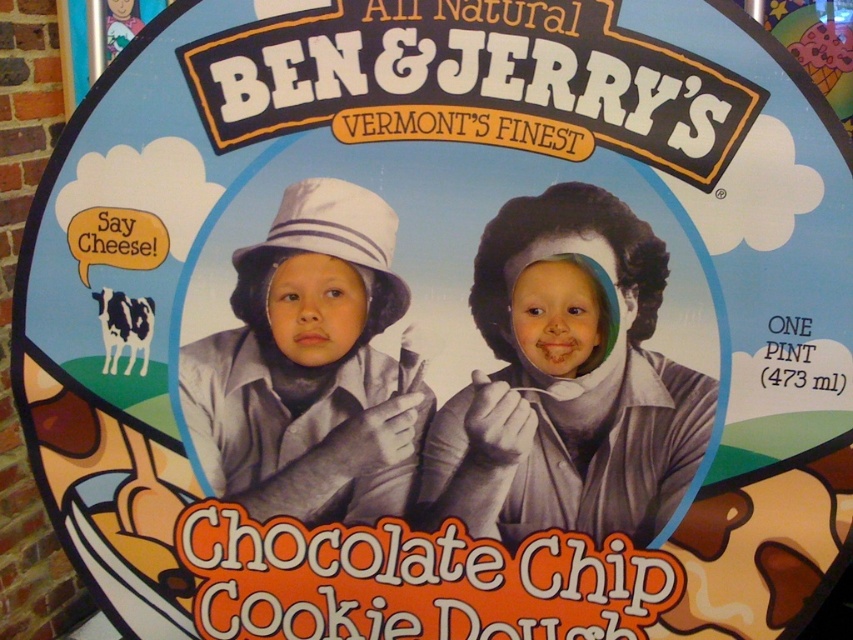
Question: Can you confirm if smooth chocolate at upper right is positioned above white matte hat at center?

Choices:
 (A) yes
 (B) no

Answer: (B)

Question: Is smooth chocolate at upper right smaller than white matte hat at center?

Choices:
 (A) no
 (B) yes

Answer: (A)

Question: Where is smooth chocolate at upper right located in relation to white matte hat at center in the image?

Choices:
 (A) right
 (B) left

Answer: (A)